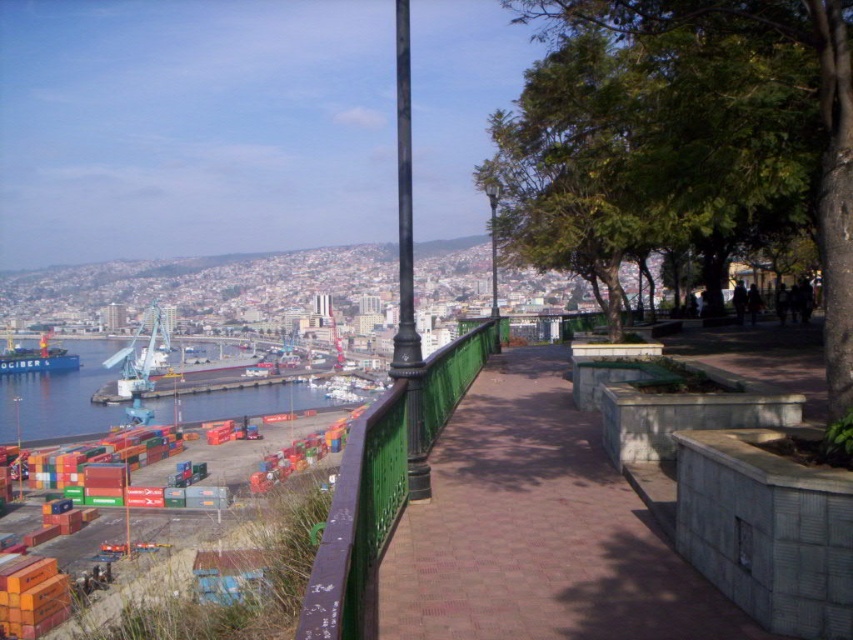
You are standing at the overlook and notice two poles ahead. The green wrought iron pole at center and the metallic pole at center. Which one is positioned to the left when facing the port area?

The green wrought iron pole at center is positioned to the left of the metallic pole at center when facing the port area.

You are a maintenance worker assigned to inspect both the green wrought iron pole at center and the metallic pole at center. Based on their sizes, which pole requires more materials for maintenance? Please explain your reasoning using the scene description.

The green wrought iron pole at center requires more materials for maintenance because it has a larger size compared to the metallic pole at center, as stated in the scene description.

You are standing at the overlook and want to take a photo of the port area. There is a green wrought iron pole at center in your way. Can you move to the right or left of it to get a clear view?

The green wrought iron pole at center is located at point (407, 273). Since it is at the center, moving either to the right or left should allow you to bypass it and get a clear view of the port area.